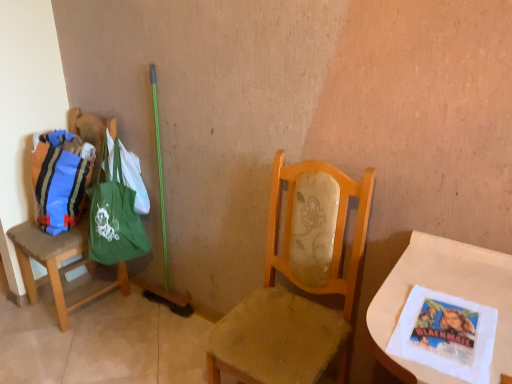
Find the location of a particular element. This screenshot has width=512, height=384. blank space situated above white paper napkin at lower right (from a real-world perspective) is located at coordinates (448, 325).